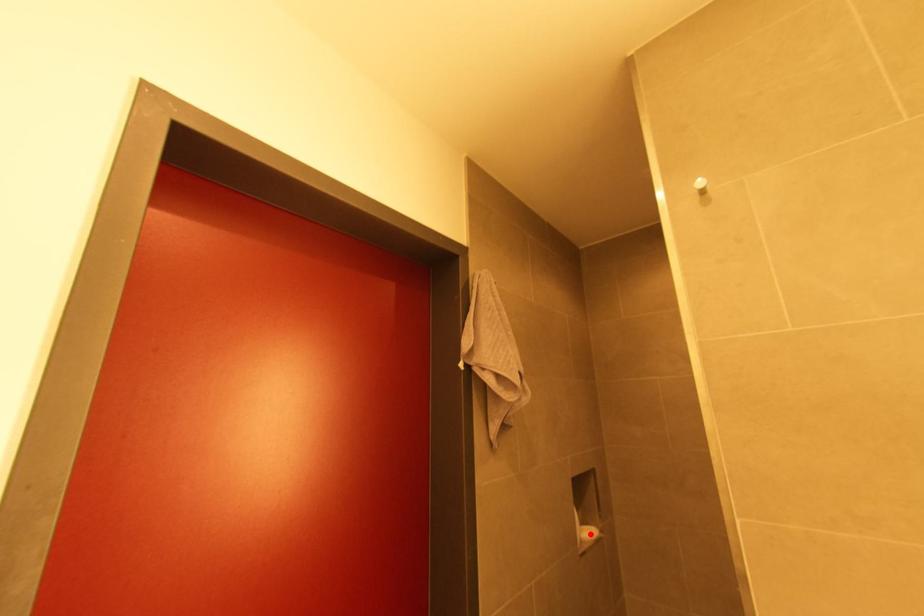
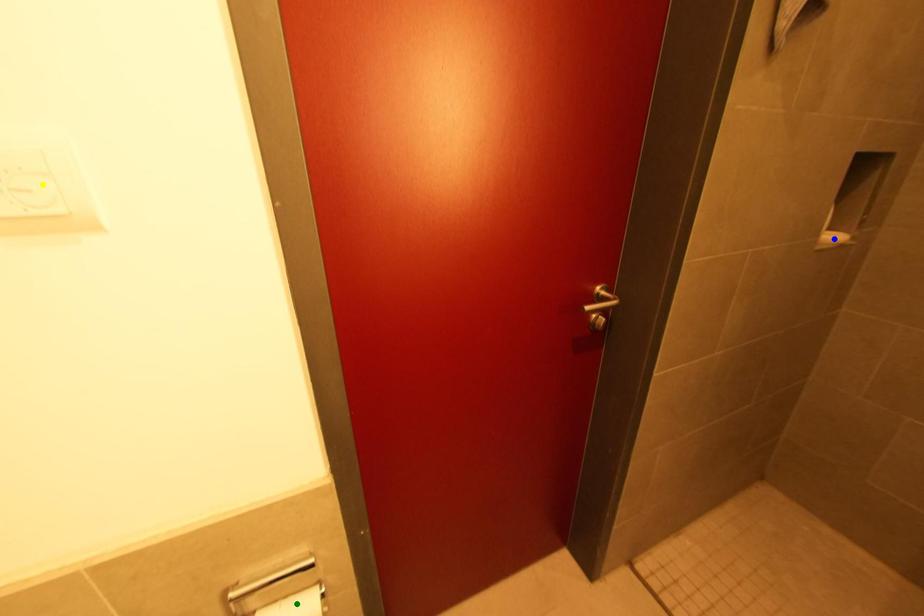
Question: I am providing you with two images of the same scene from different viewpoints. A red point is marked on the first image. You are given multiple points on the second image. Which point in image 2 represents the same 3d spot as the red point in image 1?

Choices:
 (A) yellow point
 (B) green point
 (C) blue point

Answer: (C)